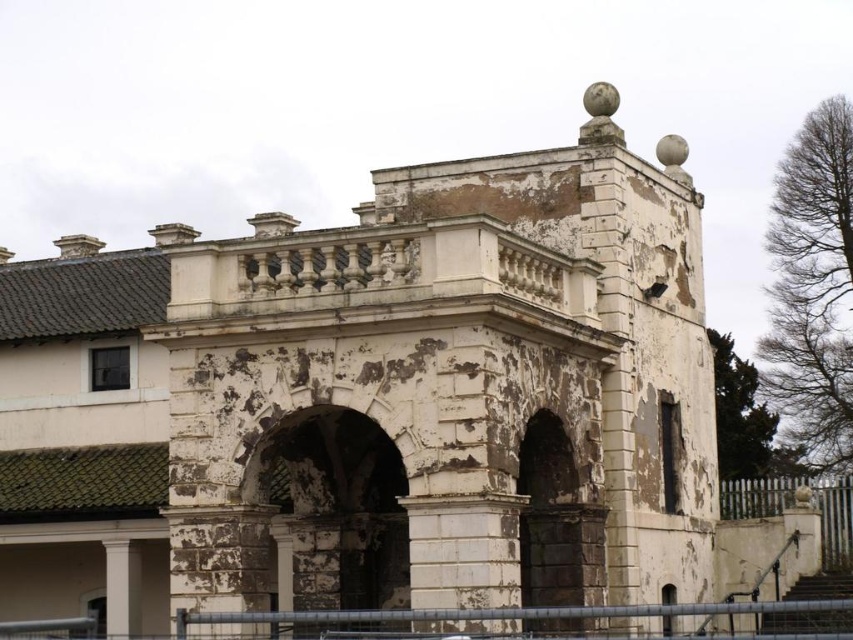
Question: Does metallic gray fence at lower center appear on the left side of white wooden fence at lower right?

Choices:
 (A) yes
 (B) no

Answer: (A)

Question: Which point is farther from the camera taking this photo?

Choices:
 (A) (845, 532)
 (B) (793, 605)

Answer: (A)

Question: Which point appears closest to the camera in this image?

Choices:
 (A) pyautogui.click(x=762, y=611)
 (B) pyautogui.click(x=849, y=509)

Answer: (A)

Question: Is metallic gray fence at lower center thinner than white wooden fence at lower right?

Choices:
 (A) yes
 (B) no

Answer: (B)

Question: Which of the following is the farthest from the observer?

Choices:
 (A) (758, 490)
 (B) (225, 624)

Answer: (A)

Question: Can you confirm if metallic gray fence at lower center is bigger than white wooden fence at lower right?

Choices:
 (A) no
 (B) yes

Answer: (B)